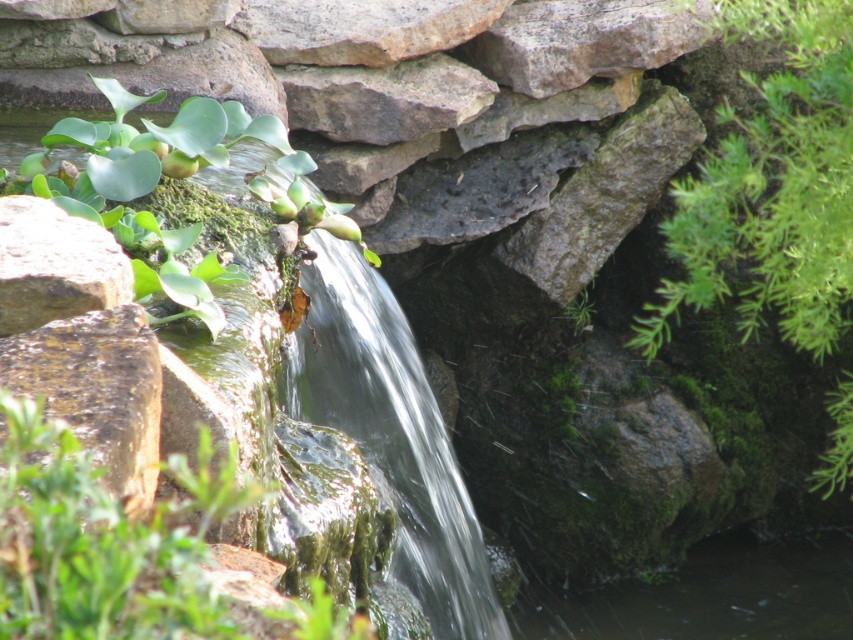
You are a GUI agent. You are given a task and a screenshot of the screen. Output one action in this format:
    pyautogui.click(x=<x>, y=<y>)
    Task: Click on the green leafy plant at center
    
    Given the screenshot: What is the action you would take?
    pyautogui.click(x=103, y=541)

Who is more distant from viewer, [15,557] or [409,584]?

Point [409,584]

Locate an element on the screen. Image resolution: width=853 pixels, height=640 pixels. green leafy plant at center is located at coordinates (103, 541).

Measure the distance from clear water at center to green leafy plant at upper left.

A distance of 3.08 meters exists between clear water at center and green leafy plant at upper left.

The height and width of the screenshot is (640, 853). What do you see at coordinates (392, 433) in the screenshot? I see `clear water at center` at bounding box center [392, 433].

Who is more forward, (378, 467) or (96, 211)?

Point (96, 211) is in front.

You are a GUI agent. You are given a task and a screenshot of the screen. Output one action in this format:
    pyautogui.click(x=<x>, y=<y>)
    Task: Click on the clear water at center
    This screenshot has width=853, height=640.
    Given the screenshot: What is the action you would take?
    pyautogui.click(x=392, y=433)

Who is positioned more to the right, green leafy plant at right or clear water at center?

green leafy plant at right

Where is `green leafy plant at right`? The height and width of the screenshot is (640, 853). green leafy plant at right is located at coordinates (773, 188).